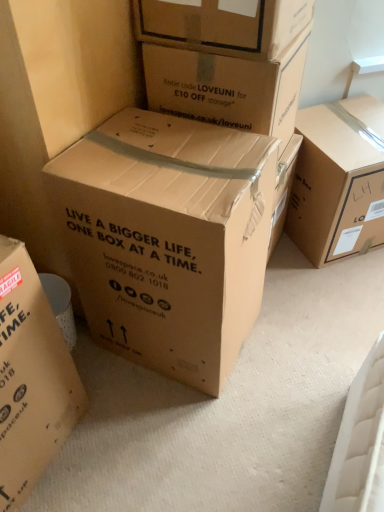
The height and width of the screenshot is (512, 384). I want to click on vacant space that is in between brown cardboard box at center, the fourth box viewed from the right, and brown cardboard box at center, which is the first box in left-to-right order, so click(x=118, y=409).